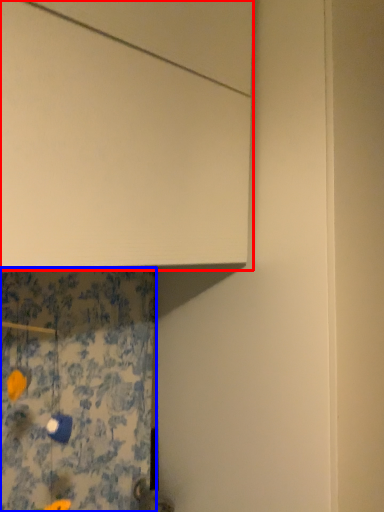
Question: Which object is closer to the camera taking this photo, cabinetry (highlighted by a red box) or shower curtain (highlighted by a blue box)?

Choices:
 (A) cabinetry
 (B) shower curtain

Answer: (B)